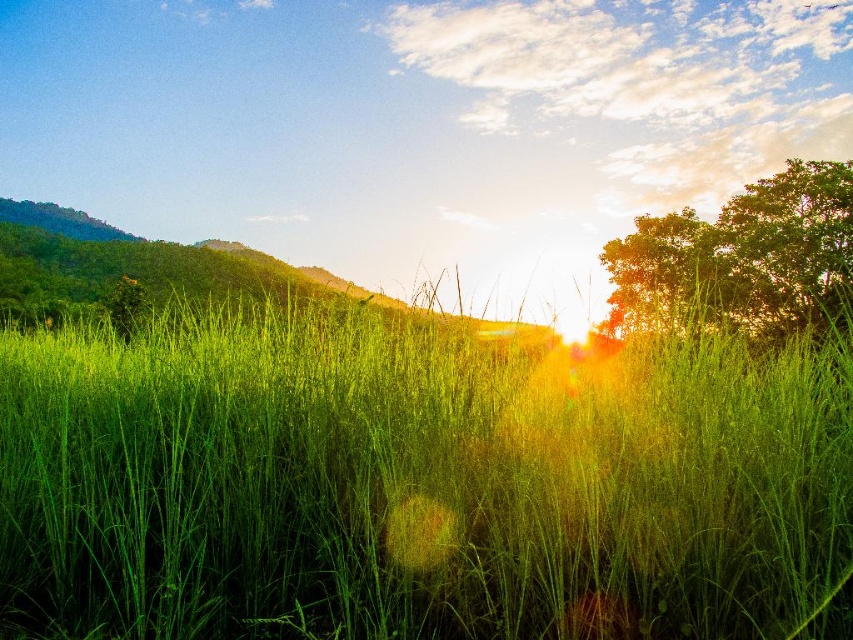
Question: Which of these objects is positioned closest to the green grassy at center?

Choices:
 (A) green grassy hillside at center
 (B) green leafy tree at upper right

Answer: (A)

Question: Can you confirm if green leafy tree at upper right is positioned to the right of green grassy hillside at center?

Choices:
 (A) yes
 (B) no

Answer: (A)

Question: Does green grassy at center come in front of green leafy tree at upper right?

Choices:
 (A) yes
 (B) no

Answer: (A)

Question: Among these points, which one is nearest to the camera?

Choices:
 (A) (239, 252)
 (B) (293, 456)
 (C) (641, 228)

Answer: (B)

Question: Considering the real-world distances, which object is closest to the green grassy at center?

Choices:
 (A) green leafy tree at upper right
 (B) green grassy hillside at center

Answer: (B)

Question: Is green grassy at center above green grassy hillside at center?

Choices:
 (A) no
 (B) yes

Answer: (A)